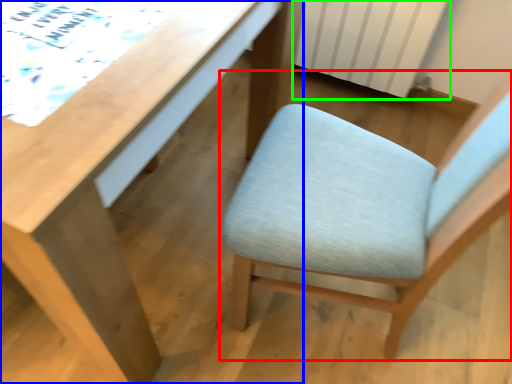
Question: Estimate the real-world distances between objects in this image. Which object is closer to chair (highlighted by a red box), desk (highlighted by a blue box) or radiator (highlighted by a green box)?

Choices:
 (A) desk
 (B) radiator

Answer: (A)